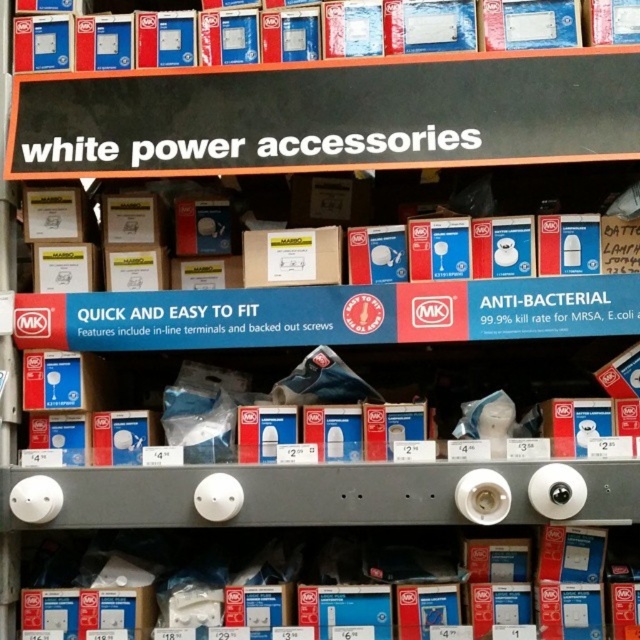
Who is positioned more to the left, black plastic signboard at upper center or white cardboard boxes at center?

Positioned to the left is black plastic signboard at upper center.

Does black plastic signboard at upper center appear on the left side of white cardboard boxes at center?

Indeed, black plastic signboard at upper center is positioned on the left side of white cardboard boxes at center.

The width and height of the screenshot is (640, 640). What do you see at coordinates (330, 115) in the screenshot?
I see `black plastic signboard at upper center` at bounding box center [330, 115].

Locate an element on the screen. black plastic signboard at upper center is located at coordinates [330, 115].

Which is above, black plastic signboard at upper center or white cardboard box at center?

black plastic signboard at upper center is higher up.

The height and width of the screenshot is (640, 640). Describe the element at coordinates (330, 115) in the screenshot. I see `black plastic signboard at upper center` at that location.

Is point (561, 115) positioned before point (257, 278)?

Yes, point (561, 115) is in front of point (257, 278).

Where is `black plastic signboard at upper center`? Image resolution: width=640 pixels, height=640 pixels. black plastic signboard at upper center is located at coordinates (330, 115).

Which is behind, point (76, 131) or point (456, 566)?

The point (456, 566) is more distant.

Does black plastic signboard at upper center have a larger size compared to white plastic light bulb at center?

No.

Identify the location of black plastic signboard at upper center. The width and height of the screenshot is (640, 640). (330, 115).